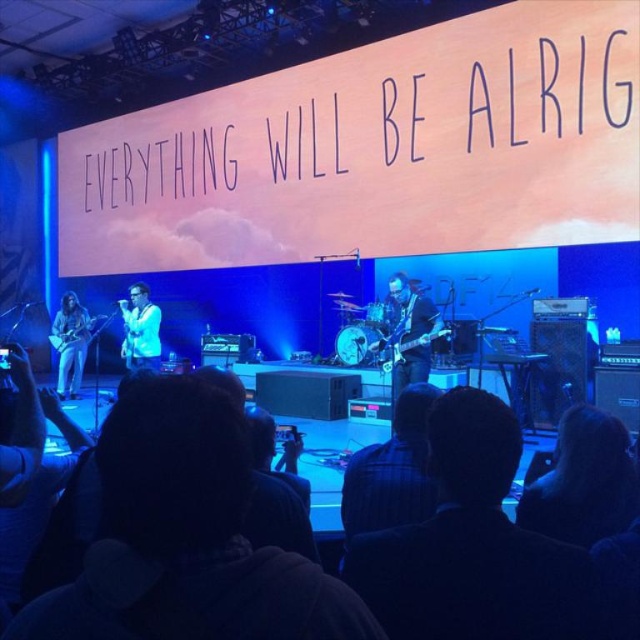
Does matte black guitar at left have a greater width compared to glossy electric guitar at center?

Yes, matte black guitar at left is wider than glossy electric guitar at center.

The height and width of the screenshot is (640, 640). Find the location of `matte black guitar at left`. matte black guitar at left is located at coordinates (70, 342).

Which is in front, point (51, 330) or point (401, 355)?

Positioned in front is point (401, 355).

Find the location of a particular element. The width and height of the screenshot is (640, 640). matte black guitar at left is located at coordinates (70, 342).

Between shiny black guitar at center and white glossy microphone at center, which one is positioned higher?

white glossy microphone at center is above.

Who is more forward, (428, 348) or (145, 307)?

Positioned in front is point (428, 348).

The height and width of the screenshot is (640, 640). Identify the location of shiny black guitar at center. (410, 333).

Where is `shiny black guitar at center`? The height and width of the screenshot is (640, 640). shiny black guitar at center is located at coordinates (410, 333).

Does matte black guitar at left have a greater height compared to white glossy microphone at center?

Correct, matte black guitar at left is much taller as white glossy microphone at center.

Can you confirm if matte black guitar at left is positioned above white glossy microphone at center?

No.

Between point (81, 320) and point (131, 323), which one is positioned in front?

Point (131, 323) is in front.

What are the coordinates of `matte black guitar at left` in the screenshot? It's located at (70, 342).